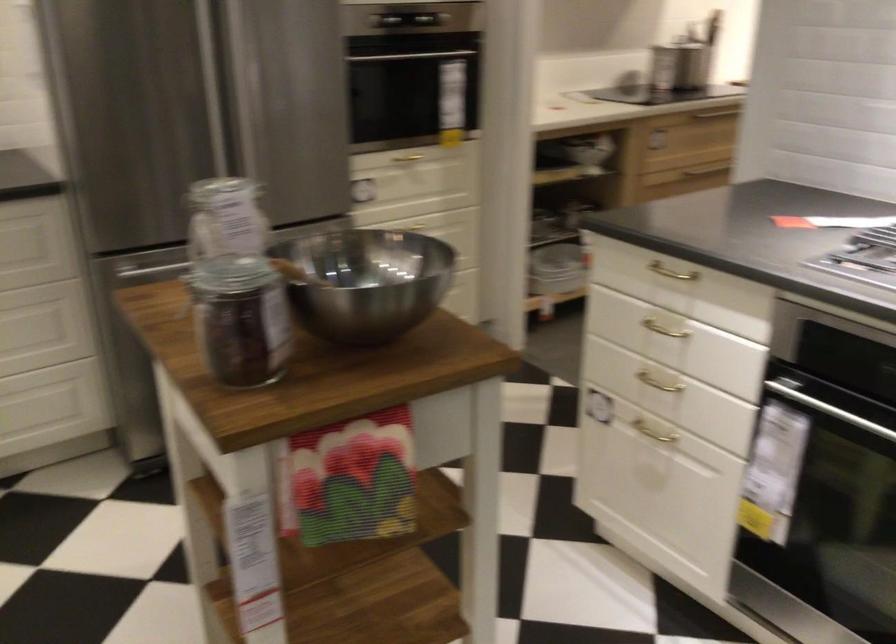
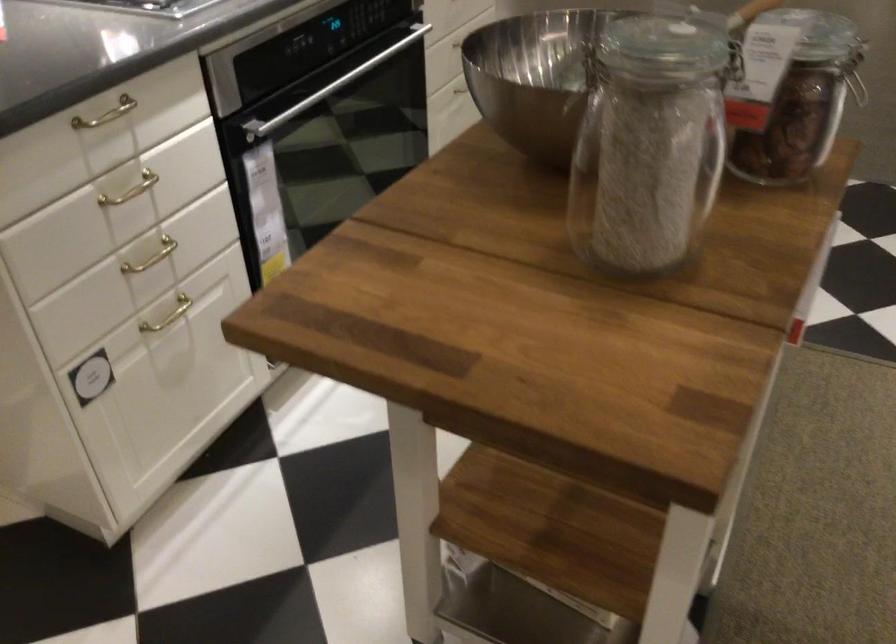
Find the pixel in the second image that matches pixel 417 295 in the first image.

(535, 77)